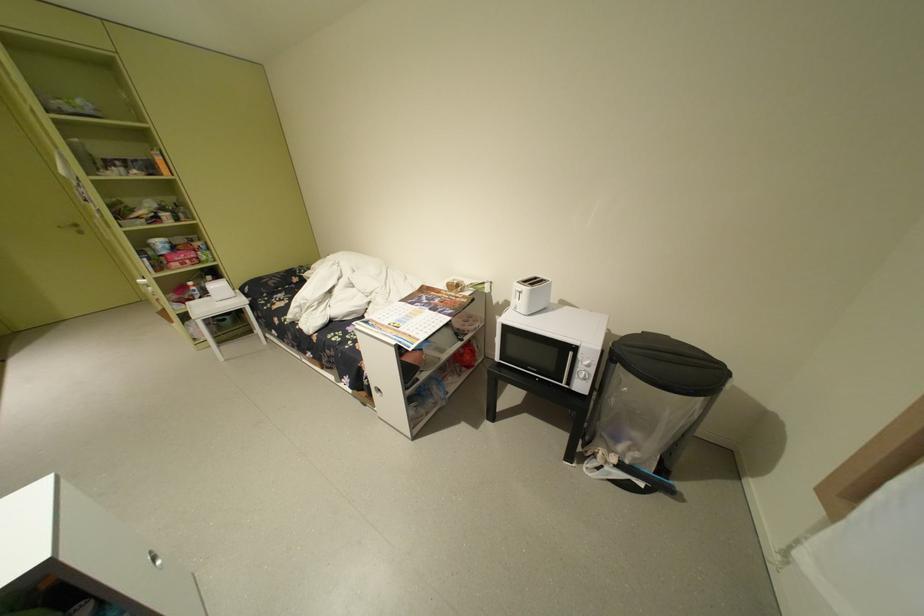
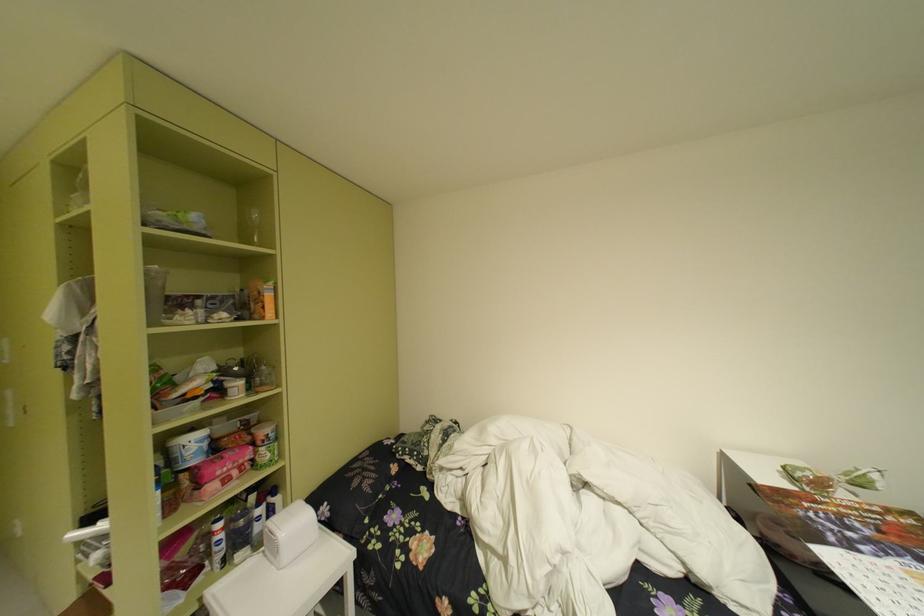
The point at (190, 253) is marked in the first image. Where is the corresponding point in the second image?

(238, 455)